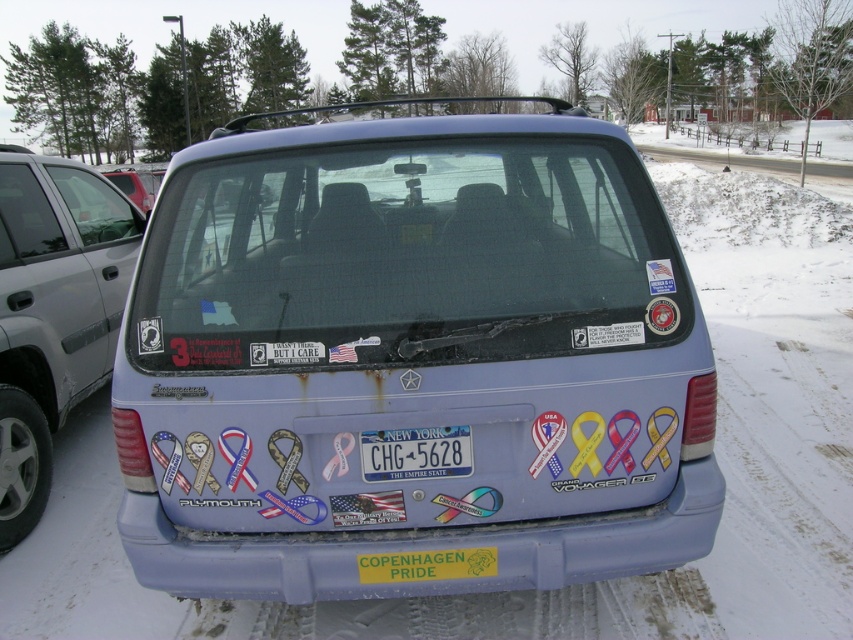
You are standing behind the light blue Plymouth Grand Voyager SE parked in a snowy environment. You notice two points marked on the ground near the car. The first point is at coordinate point (16, 352) and the second is at point (111, 177). If you were to walk from the first point to the second point, in which direction would you be moving relative to the car?

You would be moving towards the back of the car because point (16, 352) is in front of point (111, 177).

You are a delivery person trying to park your delivery van next to the matte blue van at center. The parking spot is only 1.5 meters wider than the blue plastic license plate at center. Can your van fit in the spot?

The matte blue van at center is wider than the blue plastic license plate at center. Since the parking spot is only 1.5 meters wider than the license plate, and the van is wider than the license plate, the van cannot fit in the spot.